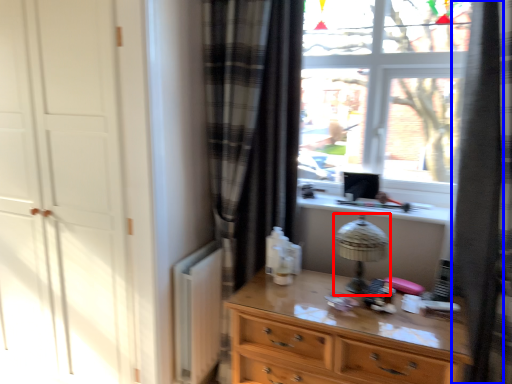
Question: Which of the following is the closest to the observer, table lamp (highlighted by a red box) or shower curtain (highlighted by a blue box)?

Choices:
 (A) table lamp
 (B) shower curtain

Answer: (B)